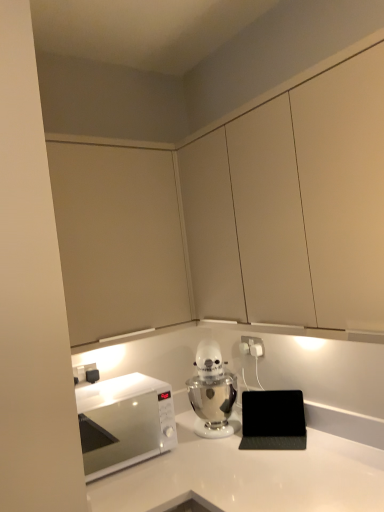
Question: Considering the relative sizes of white plastic electric outlet at center-right and matte white cabinets at upper center, which appears as the first cabinetry when viewed from the right, in the image provided, is white plastic electric outlet at center-right bigger than matte white cabinets at upper center, which appears as the first cabinetry when viewed from the right,?

Choices:
 (A) yes
 (B) no

Answer: (B)

Question: Is white plastic electric outlet at center-right positioned beyond the bounds of matte white cabinets at upper center, positioned as the second cabinetry in left-to-right order?

Choices:
 (A) no
 (B) yes

Answer: (B)

Question: Considering the relative positions of white plastic electric outlet at center-right and matte white cabinets at upper center, positioned as the second cabinetry in left-to-right order, in the image provided, is white plastic electric outlet at center-right to the right of matte white cabinets at upper center, positioned as the second cabinetry in left-to-right order, from the viewer's perspective?

Choices:
 (A) yes
 (B) no

Answer: (A)

Question: Is white plastic electric outlet at center-right placed right next to matte white cabinets at upper center, which appears as the first cabinetry when viewed from the right?

Choices:
 (A) yes
 (B) no

Answer: (B)

Question: Does white plastic electric outlet at center-right have a greater height compared to matte white cabinets at upper center, positioned as the second cabinetry in left-to-right order?

Choices:
 (A) yes
 (B) no

Answer: (B)

Question: Considering the relative sizes of white plastic electric outlet at center-right and matte white cabinets at upper center, which appears as the first cabinetry when viewed from the right, in the image provided, is white plastic electric outlet at center-right wider than matte white cabinets at upper center, which appears as the first cabinetry when viewed from the right,?

Choices:
 (A) no
 (B) yes

Answer: (A)

Question: Considering the relative sizes of matte beige cabinet at upper left, the first cabinetry from the left, and white glossy countertop at center in the image provided, is matte beige cabinet at upper left, the first cabinetry from the left, taller than white glossy countertop at center?

Choices:
 (A) no
 (B) yes

Answer: (B)

Question: Is matte beige cabinet at upper left, marked as the second cabinetry in a right-to-left arrangement, to the right of white glossy countertop at center from the viewer's perspective?

Choices:
 (A) yes
 (B) no

Answer: (B)

Question: From the image's perspective, is matte beige cabinet at upper left, marked as the second cabinetry in a right-to-left arrangement, below white glossy countertop at center?

Choices:
 (A) yes
 (B) no

Answer: (B)

Question: Considering the relative positions of matte beige cabinet at upper left, marked as the second cabinetry in a right-to-left arrangement, and white glossy countertop at center in the image provided, is matte beige cabinet at upper left, marked as the second cabinetry in a right-to-left arrangement, to the left of white glossy countertop at center from the viewer's perspective?

Choices:
 (A) no
 (B) yes

Answer: (B)

Question: Is matte beige cabinet at upper left, the first cabinetry from the left, in front of white glossy countertop at center?

Choices:
 (A) no
 (B) yes

Answer: (A)

Question: Does matte beige cabinet at upper left, the first cabinetry from the left, have a larger size compared to white glossy countertop at center?

Choices:
 (A) yes
 (B) no

Answer: (B)

Question: From a real-world perspective, does white glossy microwave at left stand above white glossy countertop at center?

Choices:
 (A) yes
 (B) no

Answer: (A)